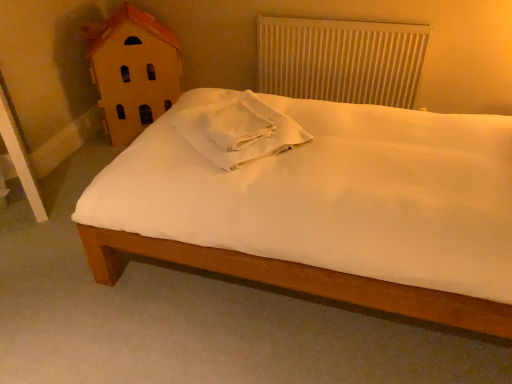
Where is `vacant space situated above white matte bed at center (from a real-world perspective)`? vacant space situated above white matte bed at center (from a real-world perspective) is located at coordinates (x=166, y=287).